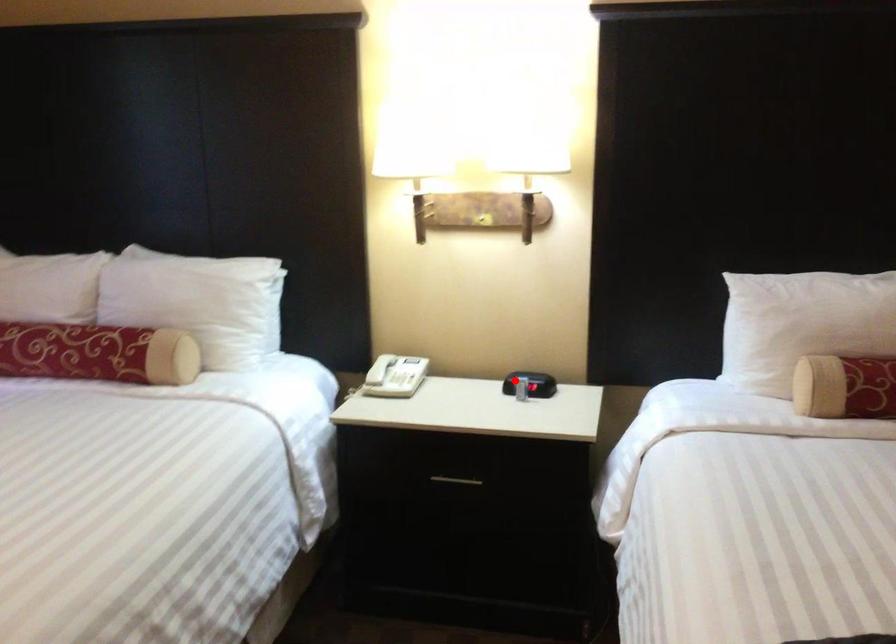
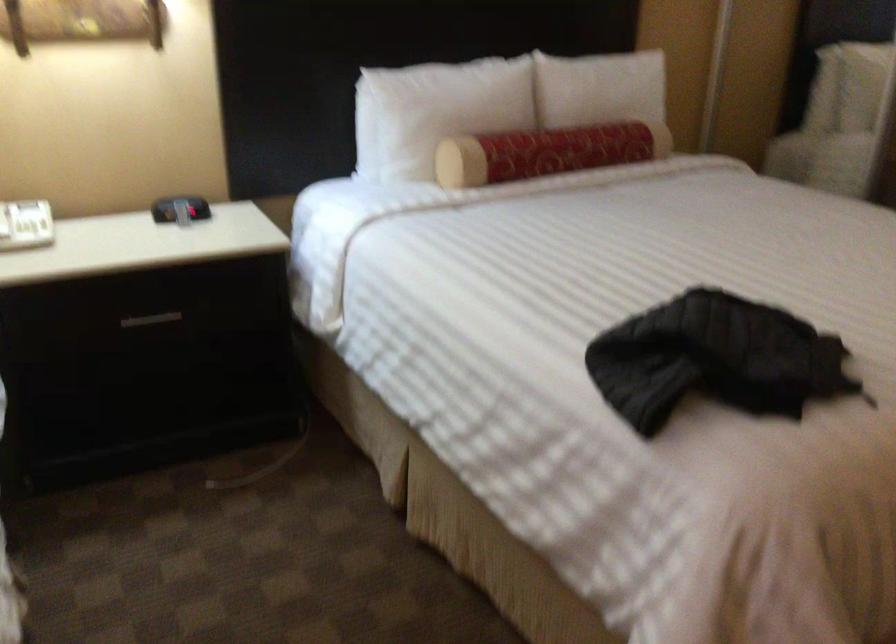
Question: I am providing you with two images of the same scene from different viewpoints. A red point is marked on the first image. Is the red point's position out of view in image 2?

Choices:
 (A) Yes
 (B) No

Answer: (B)